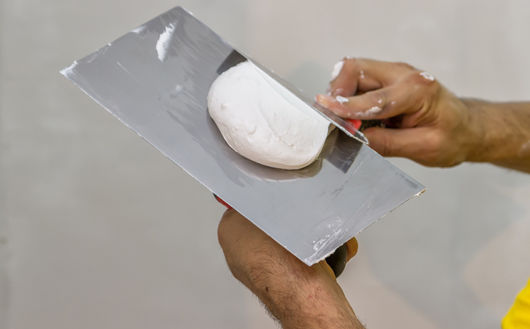
In order to click on handle in this screenshot , I will do `click(362, 124)`.